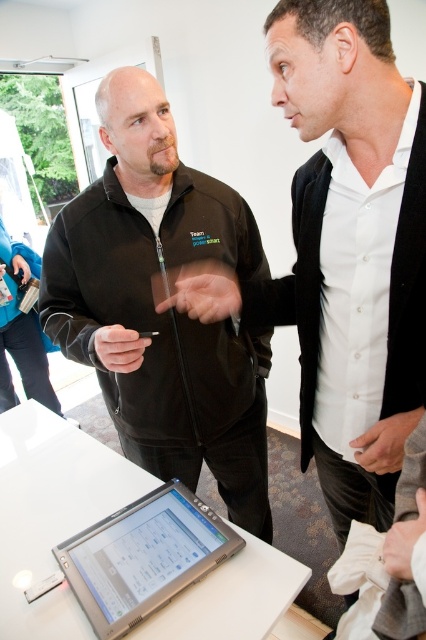
In the scene shown: Does silver metallic laptop at lower center have a larger size compared to black plastic cigarette at center?

Yes, silver metallic laptop at lower center is bigger than black plastic cigarette at center.

Is point (187, 515) positioned in front of point (146, 336)?

Yes, point (187, 515) is closer to viewer.

The height and width of the screenshot is (640, 426). Describe the element at coordinates (143, 557) in the screenshot. I see `silver metallic laptop at lower center` at that location.

Where is `silver metallic laptop at lower center`? This screenshot has height=640, width=426. silver metallic laptop at lower center is located at coordinates (143, 557).

Which is in front, point (123, 413) or point (129, 582)?

Positioned in front is point (129, 582).

Which is below, black zip-up jacket at center or silver metallic laptop at lower center?

silver metallic laptop at lower center is below.

Who is more distant from viewer, [124,275] or [132,588]?

Point [124,275]

Where is `black zip-up jacket at center`? This screenshot has width=426, height=640. black zip-up jacket at center is located at coordinates (154, 307).

Between black zip-up jacket at center and black plastic cigarette at center, which one is positioned lower?

black zip-up jacket at center

Does black zip-up jacket at center appear under black plastic cigarette at center?

Correct, black zip-up jacket at center is located below black plastic cigarette at center.

Identify the location of black zip-up jacket at center. (154, 307).

Where is `black zip-up jacket at center`? The width and height of the screenshot is (426, 640). black zip-up jacket at center is located at coordinates (154, 307).